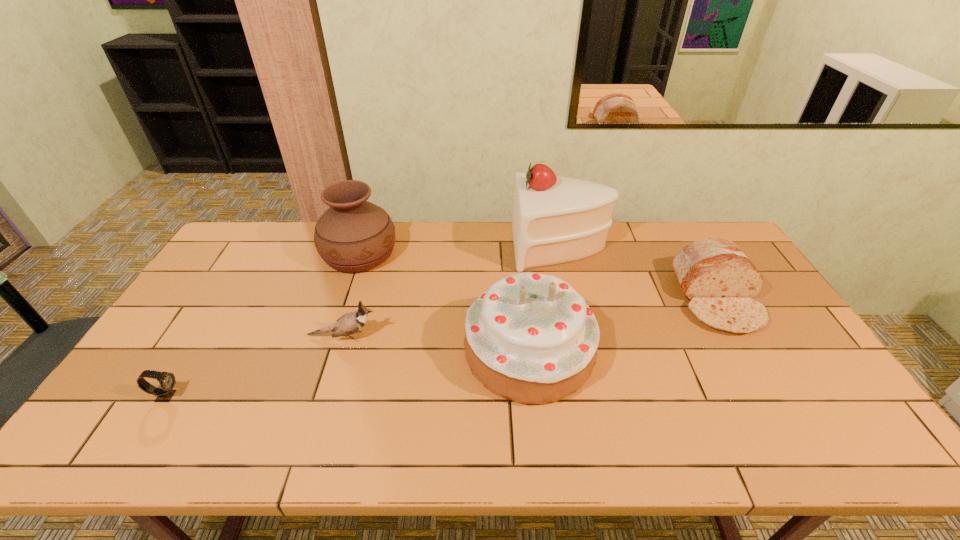
Find the location of a particular element. vacant space situated 0.400m on the right of the shorter cake is located at coordinates pos(740,351).

The image size is (960, 540). What are the coordinates of `free region located at the sliced end of the rightmost object` in the screenshot? It's located at (759, 373).

Find the location of a particular element. The image size is (960, 540). free space located 0.250m at the face of the bird is located at coordinates (468, 337).

Find the location of a particular element. The image size is (960, 540). vacant region located on the face of the shortest object is located at coordinates pos(337,395).

Where is `cake that is at the far edge`? This screenshot has height=540, width=960. cake that is at the far edge is located at coordinates (556, 219).

The image size is (960, 540). What are the coordinates of `urn that is at the far edge` in the screenshot? It's located at (353, 235).

Locate an element on the screen. This screenshot has width=960, height=540. object at the left edge is located at coordinates (167, 381).

You are a GUI agent. You are given a task and a screenshot of the screen. Output one action in this format:
    pyautogui.click(x=<x>, y=<y>)
    Task: Click on the object that is at the right edge
    The width and height of the screenshot is (960, 540).
    Given the screenshot: What is the action you would take?
    pyautogui.click(x=717, y=278)

Image resolution: width=960 pixels, height=540 pixels. In the image, there is a desktop. In order to click on free region at the far edge in this screenshot , I will do `click(422, 234)`.

Find the location of a particular element. The image size is (960, 540). vacant space at the near edge of the desktop is located at coordinates (x=774, y=425).